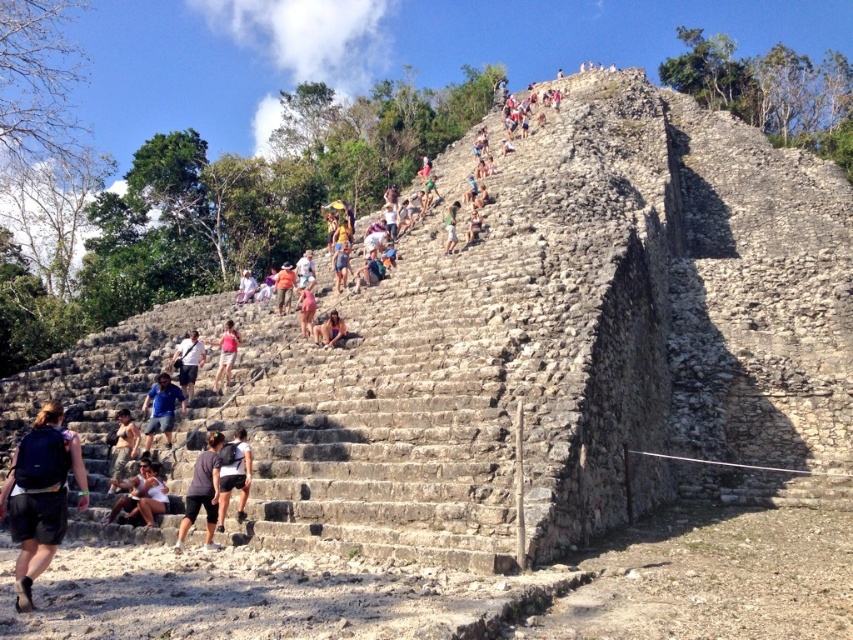
Question: Which of the following is the closest to the observer?

Choices:
 (A) green fabric shirt at upper center
 (B) dark gray stone shorts at center
 (C) white cotton shirt at center
 (D) light blue denim shorts at center

Answer: (B)

Question: Which point appears farthest from the camera in this image?

Choices:
 (A) (300, 285)
 (B) (347, 252)

Answer: (B)

Question: Is dark gray shorts at lower center above white cotton shirt at center?

Choices:
 (A) no
 (B) yes

Answer: (A)

Question: Does light blue denim shorts at center appear under matte pink bikini at center?

Choices:
 (A) no
 (B) yes

Answer: (B)

Question: Is matte black backpack at lower left closer to camera compared to white cotton shirt at center?

Choices:
 (A) no
 (B) yes

Answer: (B)

Question: Based on their relative distances, which object is nearer to the pink fabric shorts at center?

Choices:
 (A) light brown leather backpack at center
 (B) light blue denim shorts at center
 (C) white cotton shirt at center

Answer: (B)